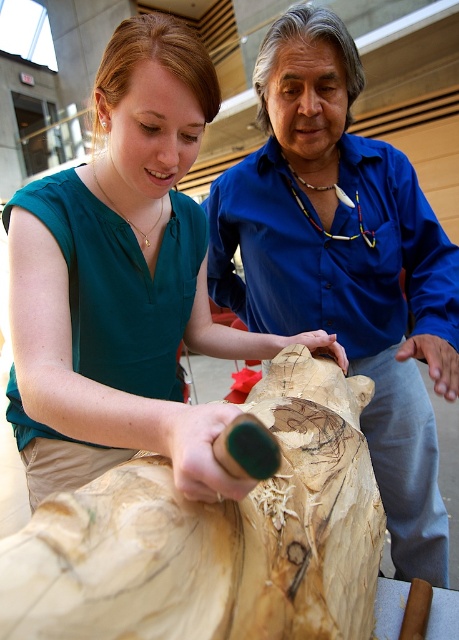
Between teal fabric shirt at center and blue smooth shirt at center, which one has less height?

teal fabric shirt at center is shorter.

Between point (87, 232) and point (436, 278), which one is positioned behind?

The point (436, 278) is more distant.

This screenshot has width=459, height=640. Find the location of `teal fabric shirt at center`. teal fabric shirt at center is located at coordinates (123, 282).